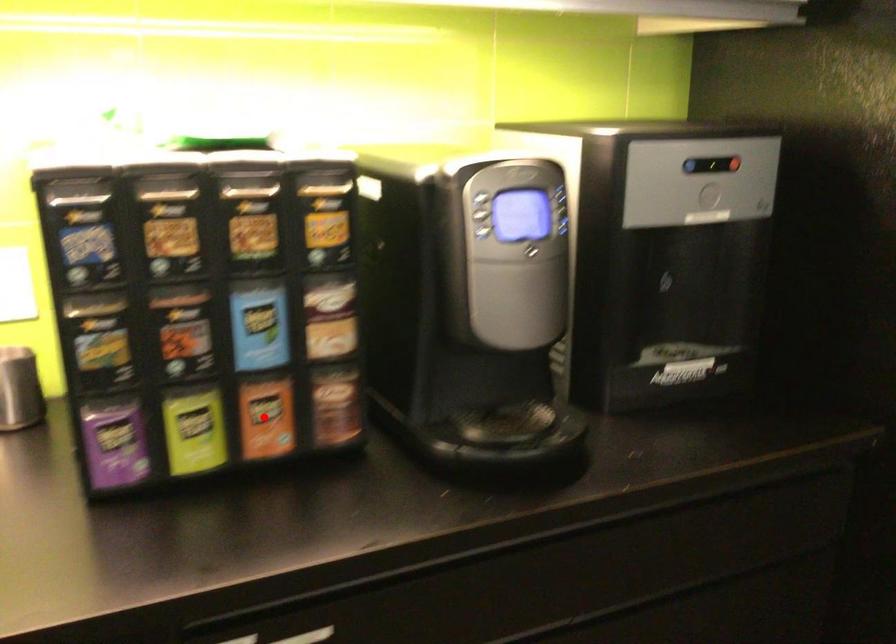
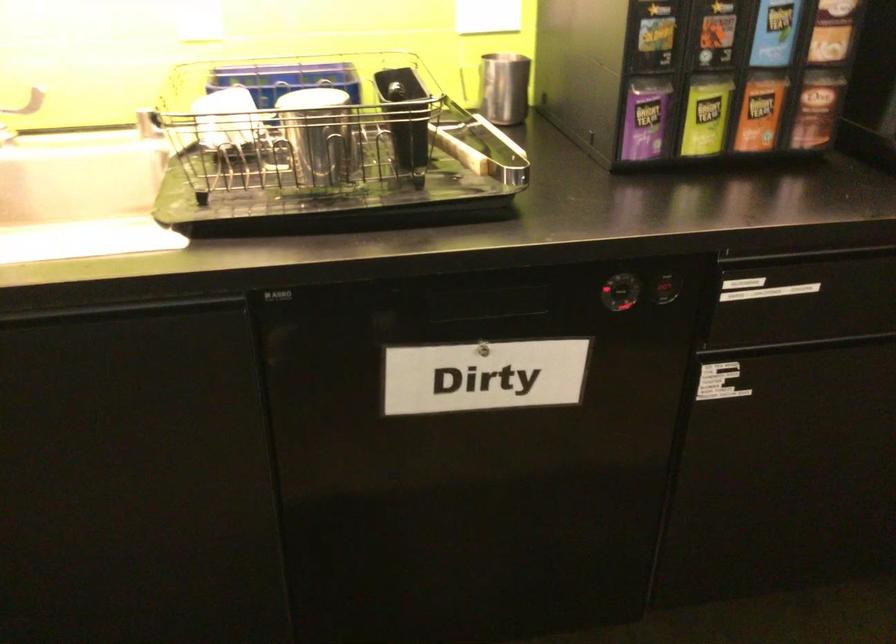
Question: I am providing you with two images of the same scene from different viewpoints. A red point is shown in image1. For the corresponding object point in image2, is it positioned nearer or farther from the camera?

Choices:
 (A) Nearer
 (B) Farther

Answer: (B)